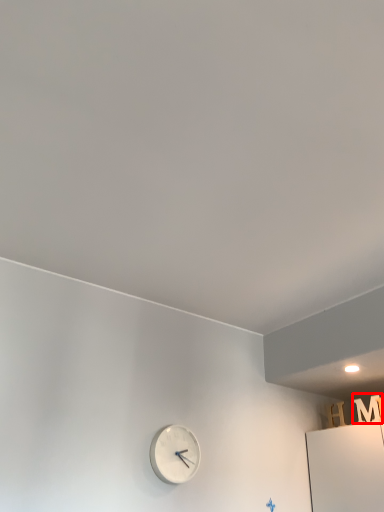
Question: From the image's perspective, what is the correct spatial relationship of letter (annotated by the red box) in relation to wall clock?

Choices:
 (A) above
 (B) below

Answer: (A)